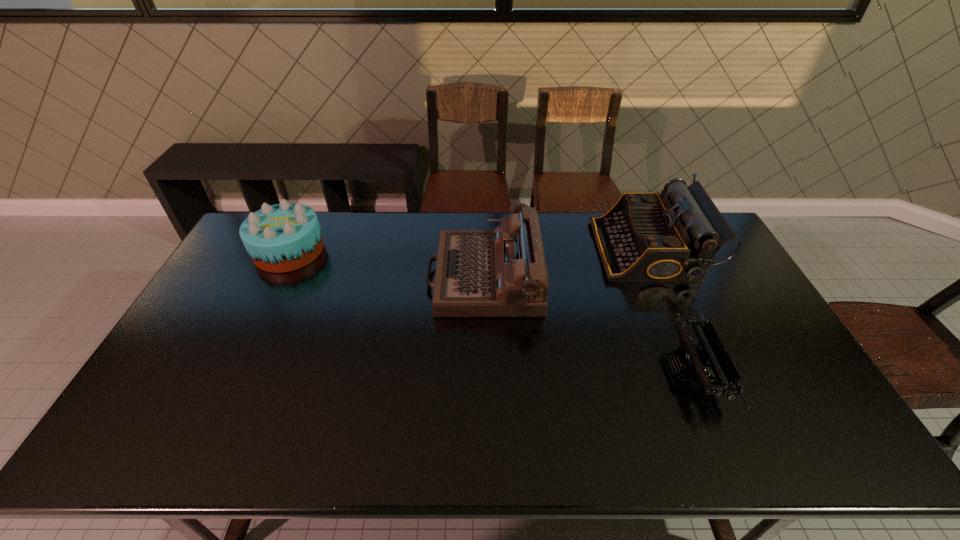
Image resolution: width=960 pixels, height=540 pixels. I want to click on the leftmost typewriter, so click(x=478, y=273).

Where is `the leftmost object`? the leftmost object is located at coordinates (284, 237).

Where is `cake`? This screenshot has width=960, height=540. cake is located at coordinates (284, 237).

The image size is (960, 540). Identify the location of the nearest typewriter. (695, 363).

Find the location of a particular element. The image size is (960, 540). the nearest object is located at coordinates (695, 363).

This screenshot has height=540, width=960. Find the location of `vacant space located on the keyboard of the leftmost typewriter`. vacant space located on the keyboard of the leftmost typewriter is located at coordinates (409, 277).

Identify the location of vacant space located 0.210m on the keyboard of the leftmost typewriter. The height and width of the screenshot is (540, 960). (364, 277).

I want to click on vacant space situated on the keyboard of the leftmost typewriter, so pos(357,277).

Locate an element on the screen. This screenshot has height=540, width=960. vacant space located on the right of the leftmost object is located at coordinates (349, 251).

Identify the location of free space located 0.330m on the typing side of the shortest typewriter. (543, 373).